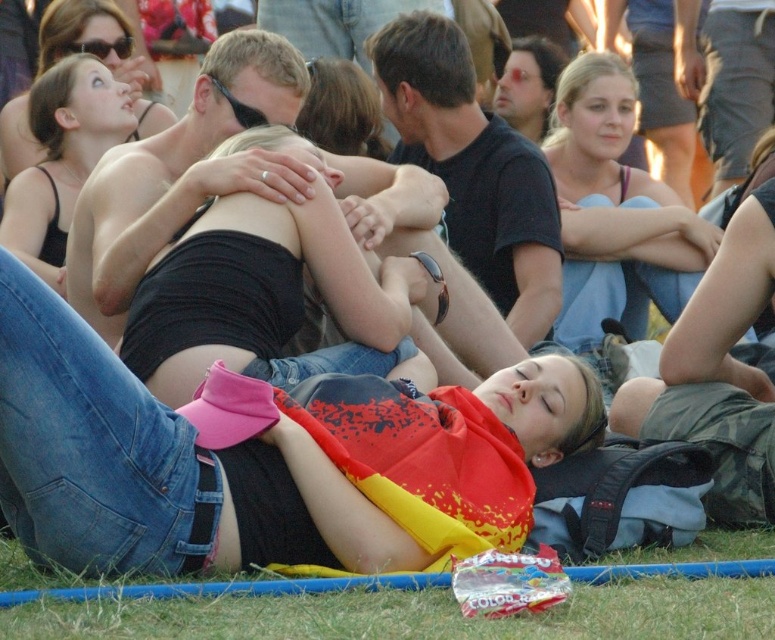
Question: Which of the following is the closest to the observer?

Choices:
 (A) (505, 474)
 (B) (567, 163)
 (C) (35, 273)

Answer: (A)

Question: Which point is farther to the camera?

Choices:
 (A) black matte tank top at center
 (B) matte black tank top at upper left
 (C) black matte tank top at upper left
 (D) blonde hair at center

Answer: (B)

Question: Which point appears closest to the camera in this image?

Choices:
 (A) (667, 234)
 (B) (372, 108)
 (C) (136, 500)
 (D) (2, 157)

Answer: (C)

Question: Does yellow and red fabric at center appear under matte black tank top at center?

Choices:
 (A) no
 (B) yes

Answer: (B)

Question: Is black matte tank top at center to the left of matte black tank top at upper left from the viewer's perspective?

Choices:
 (A) no
 (B) yes

Answer: (A)

Question: Is matte black tank top at upper left below blonde hair at center?

Choices:
 (A) no
 (B) yes

Answer: (A)